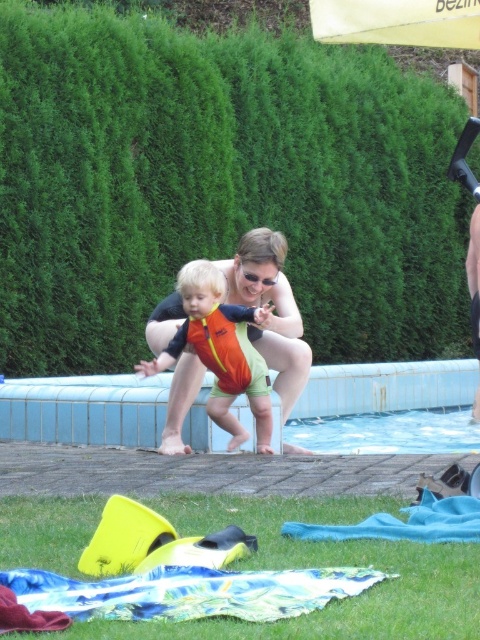
Who is shorter, green leafy hedge at upper center or blue tile swimming pool at center?

Standing shorter between the two is blue tile swimming pool at center.

Does point (324, 298) come closer to viewer compared to point (36, 422)?

That is False.

Where is `green leafy hedge at upper center`? The width and height of the screenshot is (480, 640). green leafy hedge at upper center is located at coordinates coord(217,184).

Can you confirm if green leafy hedge at upper center is positioned below printed fabric blanket at lower center?

Incorrect, green leafy hedge at upper center is not positioned below printed fabric blanket at lower center.

Between point (382, 353) and point (302, 602), which one is positioned behind?

The point (382, 353) is behind.

Does point (462, 244) come in front of point (233, 609)?

No, (462, 244) is further to viewer.

Identify the location of green leafy hedge at upper center. (217, 184).

Can you confirm if blue tile swimming pool at center is wider than printed fabric blanket at lower center?

In fact, blue tile swimming pool at center might be narrower than printed fabric blanket at lower center.

Is blue tile swimming pool at center to the left of printed fabric blanket at lower center from the viewer's perspective?

Correct, you'll find blue tile swimming pool at center to the left of printed fabric blanket at lower center.

Is point (250, 444) less distant than point (83, 595)?

No, it is behind (83, 595).

Locate an element on the screen. blue tile swimming pool at center is located at coordinates click(x=84, y=410).